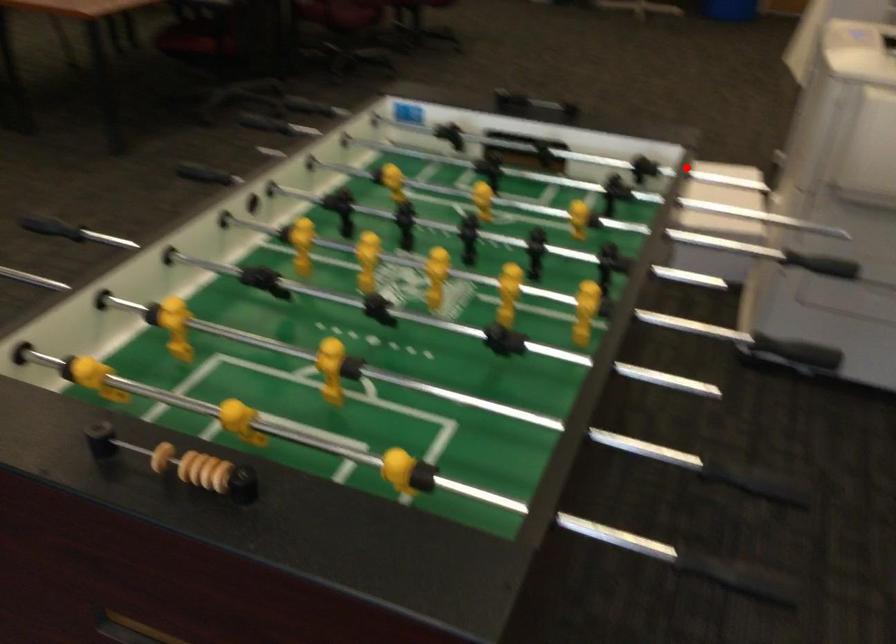
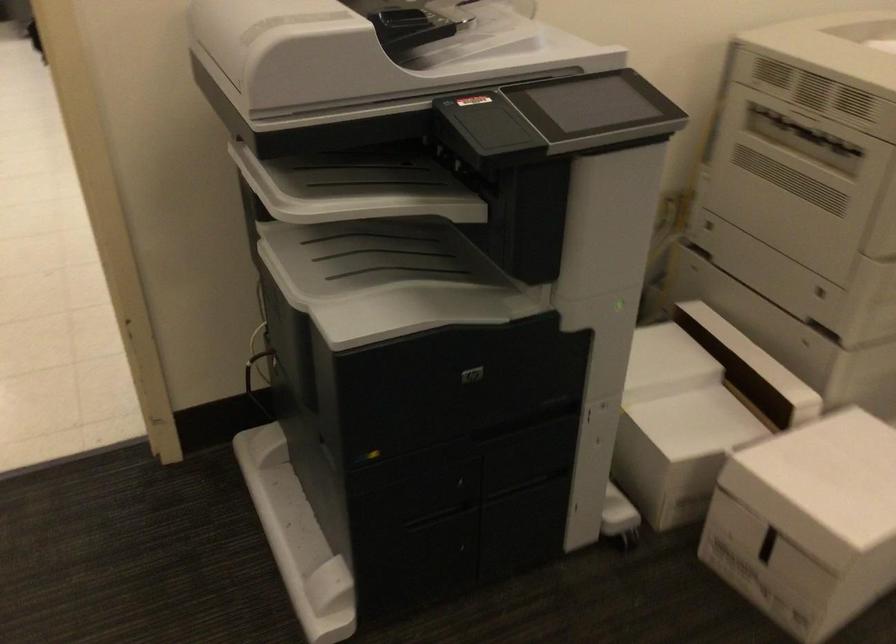
Question: I am providing you with two images of the same scene from different viewpoints. A red point is shown in image1. For the corresponding object point in image2, is it positioned nearer or farther from the camera?

Choices:
 (A) Nearer
 (B) Farther

Answer: (A)